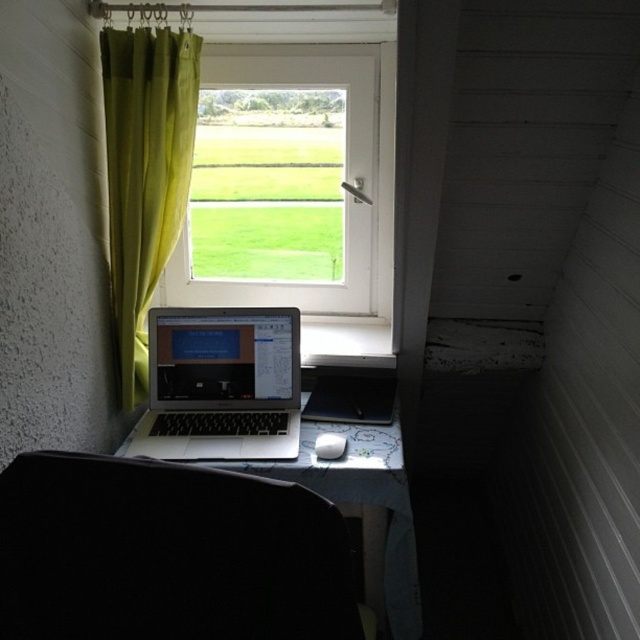
Question: Is black fabric chair at lower center positioned before yellow fabric curtain at left?

Choices:
 (A) yes
 (B) no

Answer: (A)

Question: Based on their relative distances, which object is nearer to the white cloth-covered table at center?

Choices:
 (A) sleek silver laptop at center
 (B) yellow fabric curtain at left

Answer: (A)

Question: Which of the following is the closest to the observer?

Choices:
 (A) black fabric chair at lower center
 (B) white cloth-covered table at center
 (C) sleek silver laptop at center
 (D) yellow fabric curtain at left

Answer: (A)

Question: Which point is farther to the camera?

Choices:
 (A) sleek silver laptop at center
 (B) white plastic window at upper center

Answer: (B)

Question: Is black fabric chair at lower center above sleek silver laptop at center?

Choices:
 (A) yes
 (B) no

Answer: (B)

Question: Is sleek silver laptop at center further to camera compared to white cloth-covered table at center?

Choices:
 (A) yes
 (B) no

Answer: (A)